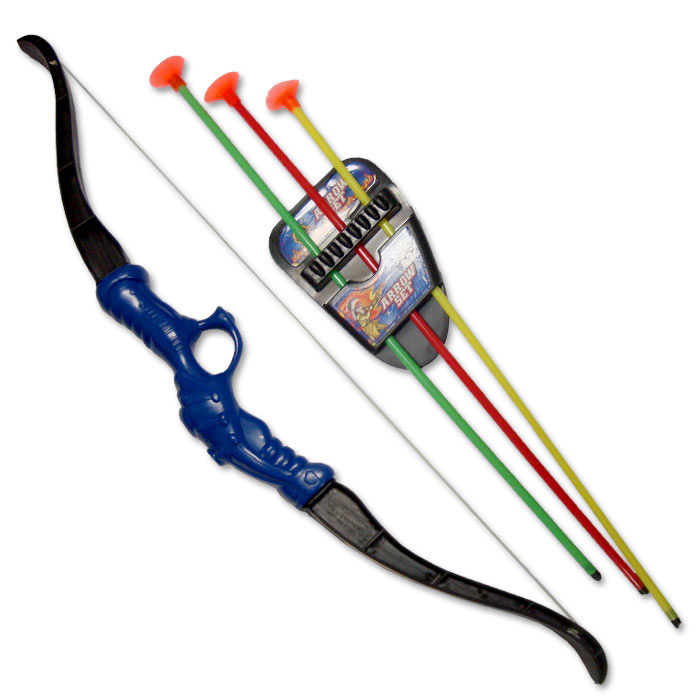
Where is `handle`? The height and width of the screenshot is (700, 700). handle is located at coordinates click(x=215, y=341).